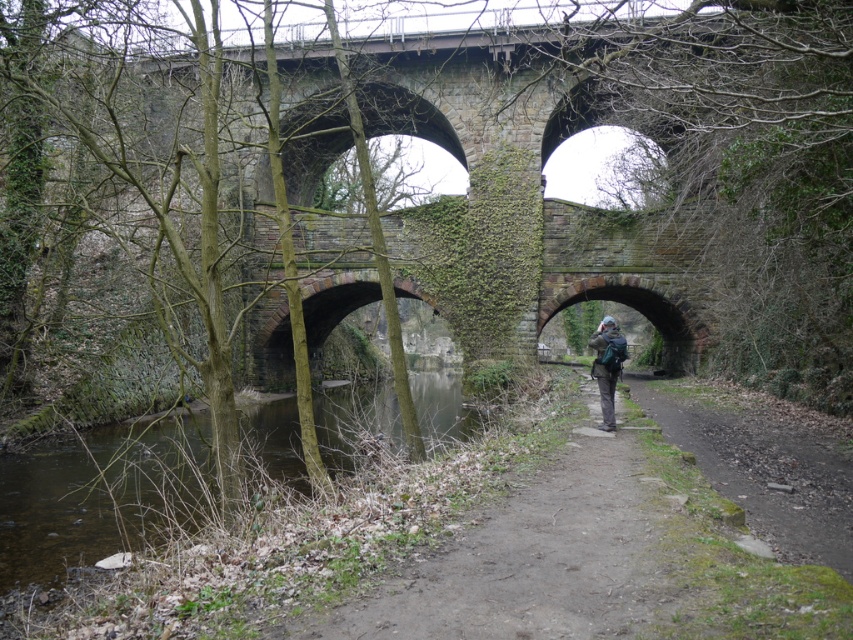
Question: Can you confirm if dirt path at center is positioned to the left of green mossy water at lower left?

Choices:
 (A) yes
 (B) no

Answer: (B)

Question: Estimate the real-world distances between objects in this image. Which object is farther from the dirt path at center?

Choices:
 (A) green backpack at center
 (B) green mossy water at lower left
 (C) brown dirt path at lower right

Answer: (B)

Question: Which of these objects is positioned farthest from the dirt path at center?

Choices:
 (A) brown dirt path at lower right
 (B) green backpack at center

Answer: (B)

Question: Which point appears closest to the camera in this image?

Choices:
 (A) (370, 387)
 (B) (581, 545)
 (C) (619, 362)
 (D) (775, 509)

Answer: (B)

Question: Is dirt path at center smaller than green backpack at center?

Choices:
 (A) no
 (B) yes

Answer: (B)

Question: Is dirt path at center wider than green mossy water at lower left?

Choices:
 (A) yes
 (B) no

Answer: (B)